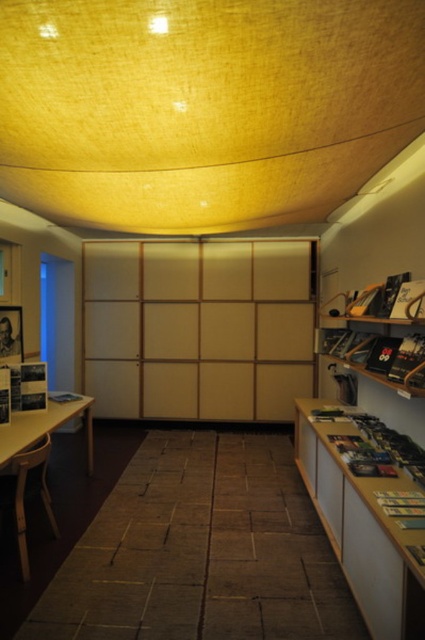
Question: Which of the following is the farthest from the observer?

Choices:
 (A) wooden bookshelf at right
 (B) matte wood table at lower left

Answer: (B)

Question: Which object is closer to the camera taking this photo?

Choices:
 (A) matte wood table at lower left
 (B) light brown wooden table at lower left

Answer: (A)

Question: Is wooden bookshelf at right thinner than light brown wooden table at lower left?

Choices:
 (A) no
 (B) yes

Answer: (A)

Question: Does wooden bookshelf at right have a smaller size compared to light brown wooden table at lower left?

Choices:
 (A) no
 (B) yes

Answer: (A)

Question: Which object is the closest to the matte wood table at lower left?

Choices:
 (A) wooden bookshelf at right
 (B) light brown wooden table at lower left

Answer: (B)

Question: Is wooden bookshelf at right to the left of matte wood table at lower left from the viewer's perspective?

Choices:
 (A) no
 (B) yes

Answer: (A)